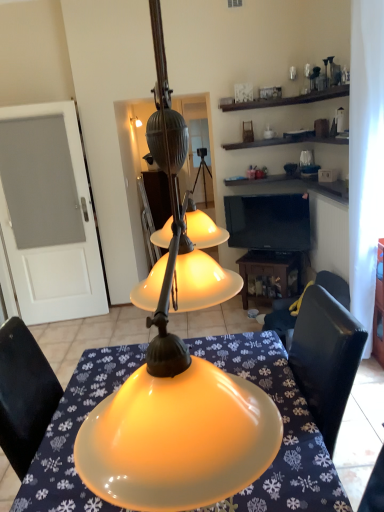
Question: Is matte yellow lampshade at center positioned with its back to wooden table at lower center?

Choices:
 (A) no
 (B) yes

Answer: (A)

Question: Is matte yellow lampshade at center positioned in front of wooden table at lower center?

Choices:
 (A) yes
 (B) no

Answer: (A)

Question: From the image's perspective, does matte yellow lampshade at center appear lower than wooden table at lower center?

Choices:
 (A) no
 (B) yes

Answer: (B)

Question: From a real-world perspective, is matte yellow lampshade at center on wooden table at lower center?

Choices:
 (A) yes
 (B) no

Answer: (A)

Question: Is matte yellow lampshade at center positioned beyond the bounds of wooden table at lower center?

Choices:
 (A) no
 (B) yes

Answer: (B)

Question: Is black leather chair at lower right to the left or to the right of wooden table at lower center in the image?

Choices:
 (A) left
 (B) right

Answer: (B)

Question: In the image, is black leather chair at lower right positioned in front of or behind wooden table at lower center?

Choices:
 (A) front
 (B) behind

Answer: (A)

Question: Is black leather chair at lower right spatially inside wooden table at lower center, or outside of it?

Choices:
 (A) inside
 (B) outside

Answer: (B)

Question: Considering the positions of point (271, 320) and point (299, 254), is point (271, 320) closer or farther from the camera than point (299, 254)?

Choices:
 (A) closer
 (B) farther

Answer: (A)

Question: From a real-world perspective, is matte yellow glass lampshade at center physically located above or below black glossy tv at upper right?

Choices:
 (A) below
 (B) above

Answer: (B)

Question: From the image's perspective, is matte yellow glass lampshade at center located above or below black glossy tv at upper right?

Choices:
 (A) below
 (B) above

Answer: (B)

Question: Is matte yellow glass lampshade at center bigger or smaller than black glossy tv at upper right?

Choices:
 (A) big
 (B) small

Answer: (A)

Question: In the image, is matte yellow glass lampshade at center on the left side or the right side of black glossy tv at upper right?

Choices:
 (A) right
 (B) left

Answer: (B)

Question: Looking at their shapes, would you say white sheer curtain at right is wider or thinner than matte yellow glass lampshade at center?

Choices:
 (A) wide
 (B) thin

Answer: (B)

Question: Considering their positions, is white sheer curtain at right located in front of or behind matte yellow glass lampshade at center?

Choices:
 (A) behind
 (B) front

Answer: (A)